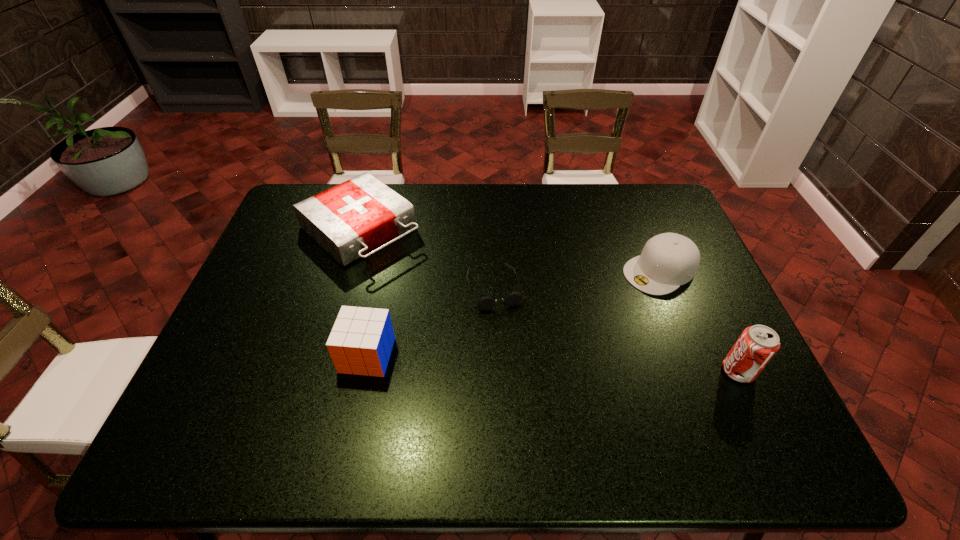
Find the location of `free space located on the front side of the first-aid kit`. free space located on the front side of the first-aid kit is located at coordinates (444, 300).

Image resolution: width=960 pixels, height=540 pixels. In order to click on vacant position located on the front-facing side of the third object from right to left in this screenshot , I will do [x=509, y=333].

Find the location of a particular element. blank space located 0.240m on the front-facing side of the third object from right to left is located at coordinates (526, 389).

The image size is (960, 540). What are the coordinates of `blank space located on the front-facing side of the third object from right to left` in the screenshot? It's located at (517, 361).

Where is `free location located 0.340m on the front-facing side of the cap`? This screenshot has height=540, width=960. free location located 0.340m on the front-facing side of the cap is located at coordinates (541, 336).

Find the location of a particular element. free spot located on the front-facing side of the cap is located at coordinates (560, 326).

The image size is (960, 540). I want to click on vacant space located 0.280m on the front-facing side of the cap, so click(560, 326).

Where is `object at the far edge`? This screenshot has height=540, width=960. object at the far edge is located at coordinates (349, 220).

At what (x,y) coordinates should I click in order to perform the action: click on object that is positioned at the near edge. Please return your answer as a coordinate pair (x, y). This screenshot has width=960, height=540. Looking at the image, I should click on (757, 344).

This screenshot has width=960, height=540. I want to click on object that is positioned at the left edge, so click(x=349, y=220).